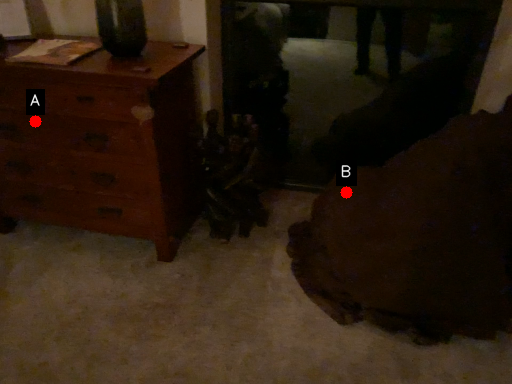
Question: Two points are circled on the image, labeled by A and B beside each circle. Which point is farther from the camera taking this photo?

Choices:
 (A) A is further
 (B) B is further

Answer: (B)